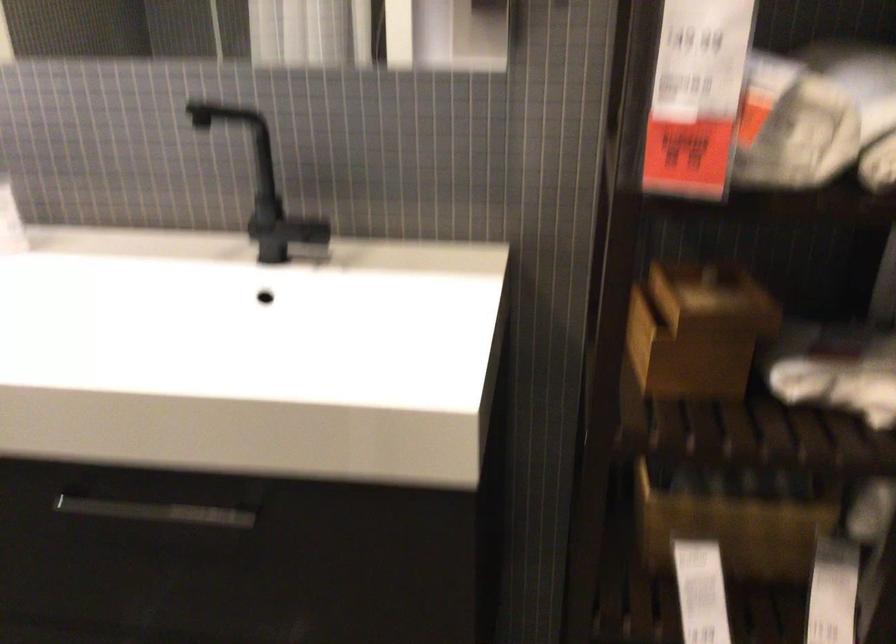
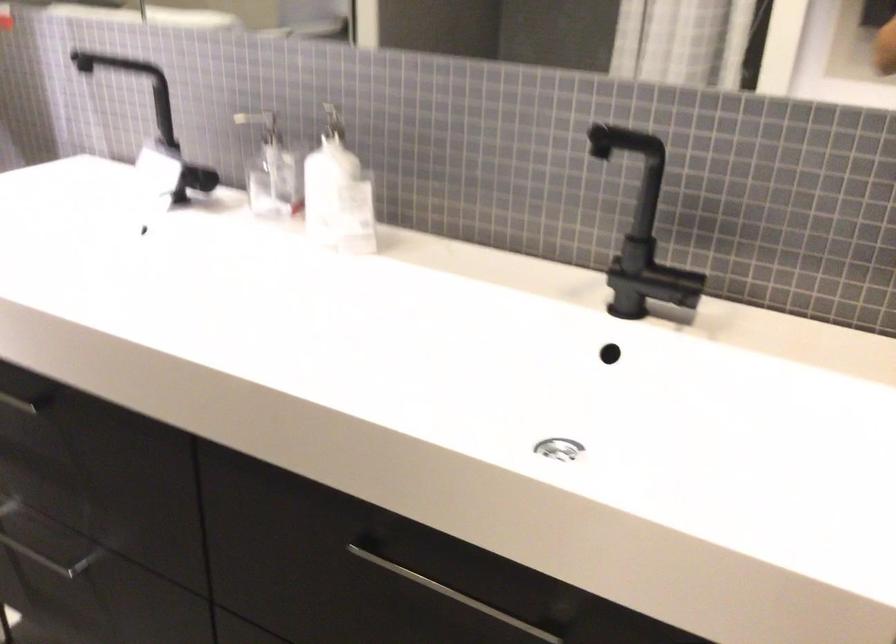
In a continuous first-person perspective shot, in which direction is the camera moving?

The movement direction of the cameraman is left, forward.